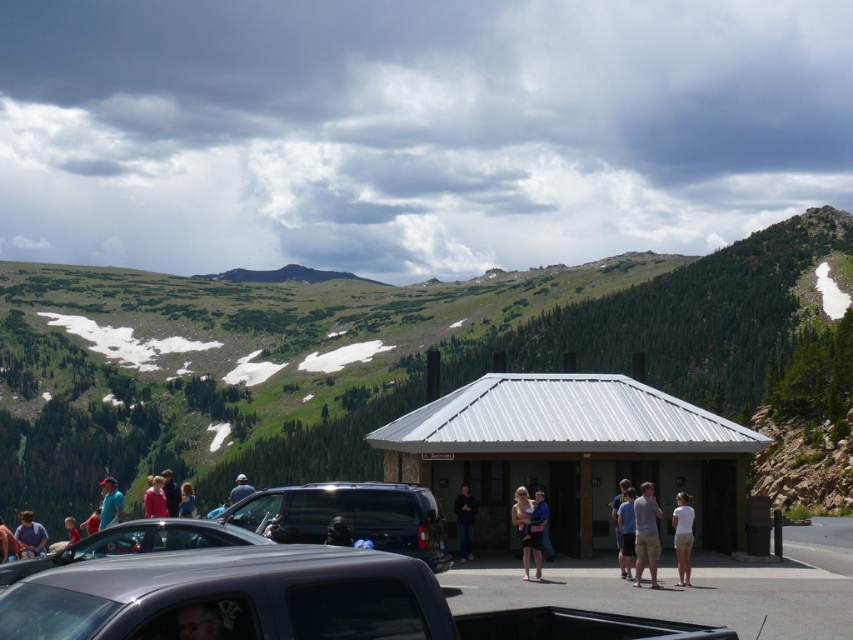
Question: Based on their relative distances, which object is nearer to the red shirt at lower left?

Choices:
 (A) matte blue shirt at center
 (B) metallic gray truck at center
 (C) white cotton shirt at center
 (D) matte blue dress at center

Answer: (D)

Question: Is matte black sunglasses at lower left bigger than light blue shirt at center?

Choices:
 (A) no
 (B) yes

Answer: (A)

Question: Can you confirm if tan cotton shorts at center is smaller than matte pink shirt at left?

Choices:
 (A) yes
 (B) no

Answer: (A)

Question: Which object is the closest to the metallic gray truck at center?

Choices:
 (A) matte black sunglasses at lower left
 (B) matte blue dress at center

Answer: (A)

Question: Which of these objects is positioned closest to the dark gray asphalt parking lot at center?

Choices:
 (A) dark brown rocky mountain at upper center
 (B) tan cotton shorts at center
 (C) dark brown leather jacket at center
 (D) matte blue shirt at center

Answer: (B)

Question: Is dark blue shirt at center in front of matte pink shirt at left?

Choices:
 (A) yes
 (B) no

Answer: (B)